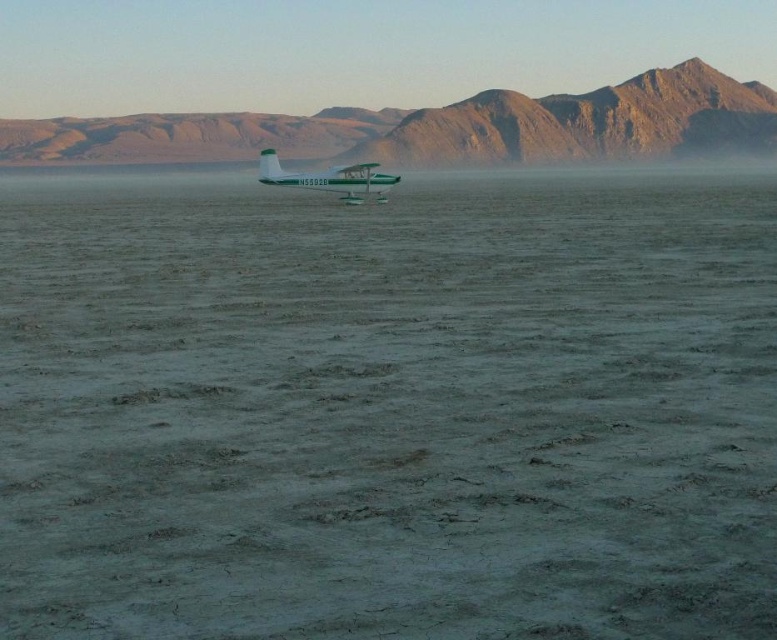
Question: Estimate the real-world distances between objects in this image. Which object is farther from the green matte seaplane at center?

Choices:
 (A) rugged brown mountain at center
 (B) gray matte sand at center

Answer: (A)

Question: Can you confirm if rugged brown mountain at center is wider than green matte seaplane at center?

Choices:
 (A) no
 (B) yes

Answer: (B)

Question: Does gray matte sand at center appear on the left side of rugged brown mountain at center?

Choices:
 (A) yes
 (B) no

Answer: (B)

Question: Which point is closer to the camera taking this photo?

Choices:
 (A) (388, 180)
 (B) (706, 131)

Answer: (A)

Question: Estimate the real-world distances between objects in this image. Which object is closer to the green matte seaplane at center?

Choices:
 (A) gray matte sand at center
 (B) rugged brown mountain at center

Answer: (A)

Question: Where is gray matte sand at center located in relation to green matte seaplane at center in the image?

Choices:
 (A) left
 (B) right

Answer: (B)